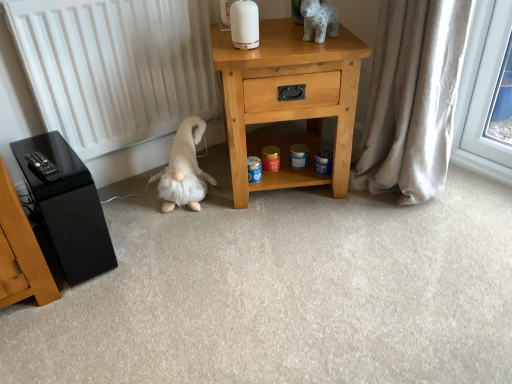
Locate an element on the screen. The width and height of the screenshot is (512, 384). free region on the left part of beige fabric curtain at right is located at coordinates (344, 211).